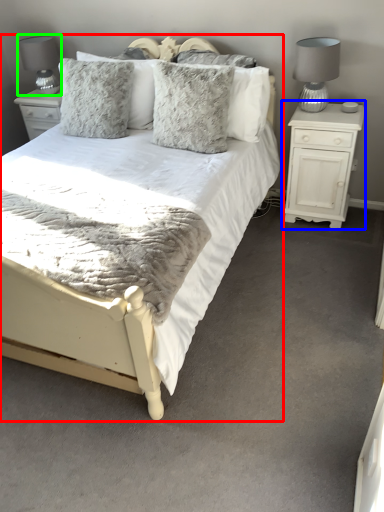
Question: Based on their relative distances, which object is nearer to bed (highlighted by a red box)? Choose from nightstand (highlighted by a blue box) and table lamp (highlighted by a green box).

Choices:
 (A) nightstand
 (B) table lamp

Answer: (A)